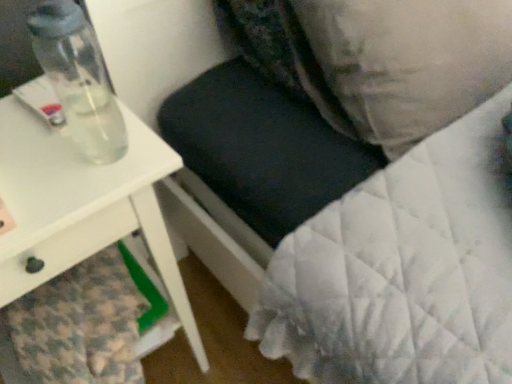
Question: Is velvety black pillow at upper center, positioned as the 2th pillow in right-to-left order, in front of or behind white quilted pillow at upper right, the 2th pillow when ordered from left to right, in the image?

Choices:
 (A) front
 (B) behind

Answer: (B)

Question: In terms of size, does velvety black pillow at upper center, the first pillow from the left, appear bigger or smaller than white quilted pillow at upper right, the 2th pillow when ordered from left to right?

Choices:
 (A) small
 (B) big

Answer: (A)

Question: Considering the real-world distances, which object is farthest from the white glossy table at left?

Choices:
 (A) clear glass bottle at left
 (B) velvety black pillow at upper center, the first pillow from the left
 (C) white quilted pillow at upper right, arranged as the first pillow when viewed from the right

Answer: (C)

Question: Which object is the farthest from the velvety black pillow at upper center, positioned as the 2th pillow in right-to-left order?

Choices:
 (A) clear glass bottle at left
 (B) white quilted pillow at upper right, the 2th pillow when ordered from left to right
 (C) white glossy table at left

Answer: (C)